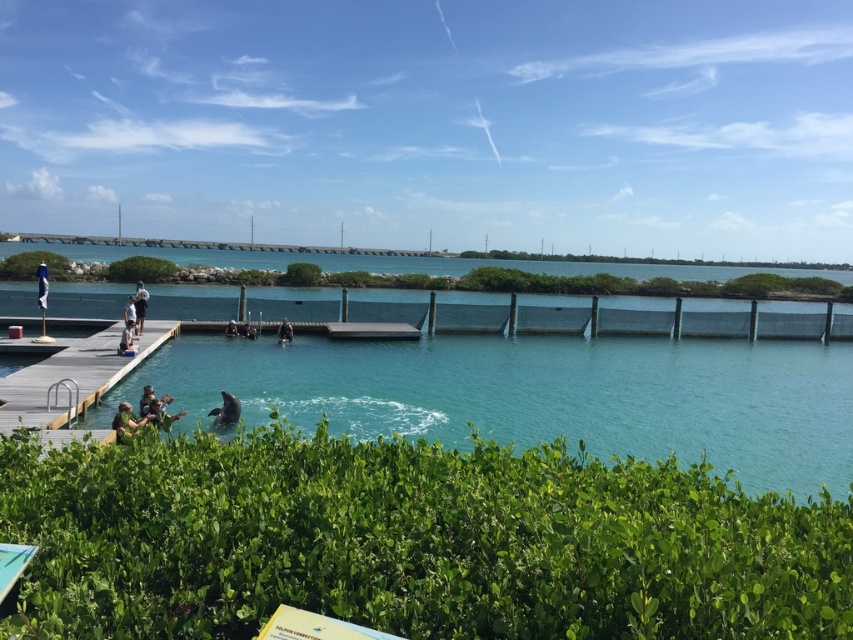
Question: Which point appears closest to the camera in this image?

Choices:
 (A) (33, 253)
 (B) (135, 275)
 (C) (120, 340)
 (D) (158, 410)

Answer: (D)

Question: Can you confirm if light brown wooden chair at lower left is positioned below dark brown wooden dock at center?

Choices:
 (A) yes
 (B) no

Answer: (A)

Question: Does green leafy shrub at lower center come in front of blue fabric umbrella at upper center?

Choices:
 (A) yes
 (B) no

Answer: (A)

Question: Observing the image, what is the correct spatial positioning of green leafy bush at left in reference to light brown wooden chair at lower left?

Choices:
 (A) left
 (B) right

Answer: (A)

Question: Which point appears farthest from the camera in this image?

Choices:
 (A) (120, 424)
 (B) (132, 294)
 (C) (131, 262)
 (D) (160, 397)

Answer: (C)

Question: Which object is the closest to the dark brown wooden dock at center?

Choices:
 (A) green leafy bush at center
 (B) green fabric person at lower left
 (C) dark blue fabric person at center

Answer: (C)